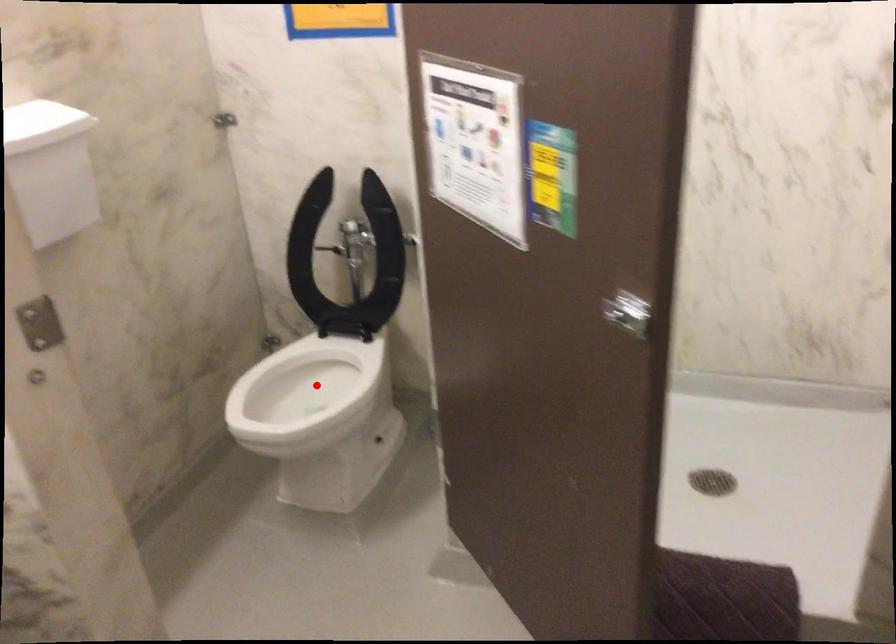
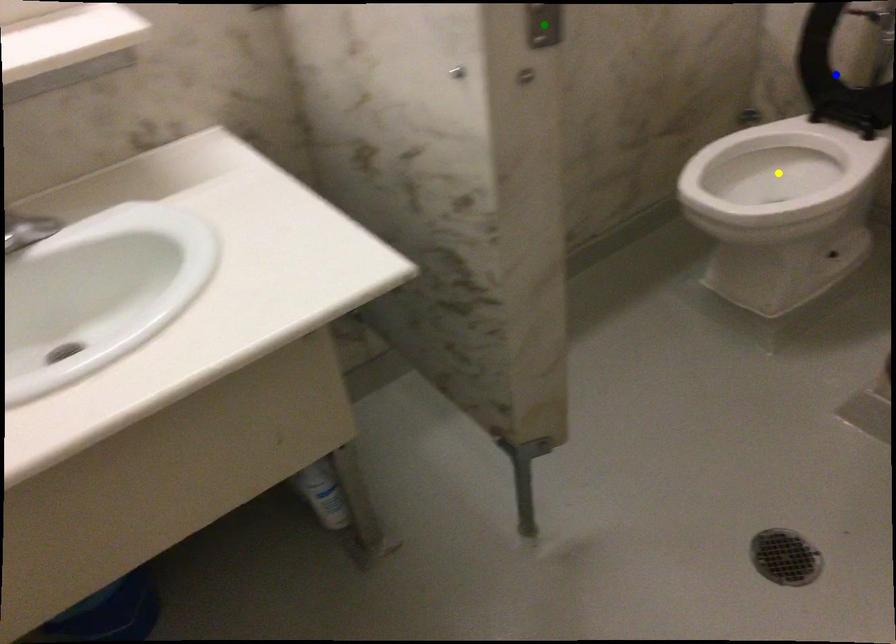
Question: I am providing you with two images of the same scene from different viewpoints. A red point is marked on the first image. You are given multiple points on the second image. Can you choose the point in image 2 that corresponds to the point in image 1?

Choices:
 (A) green point
 (B) blue point
 (C) yellow point

Answer: (C)